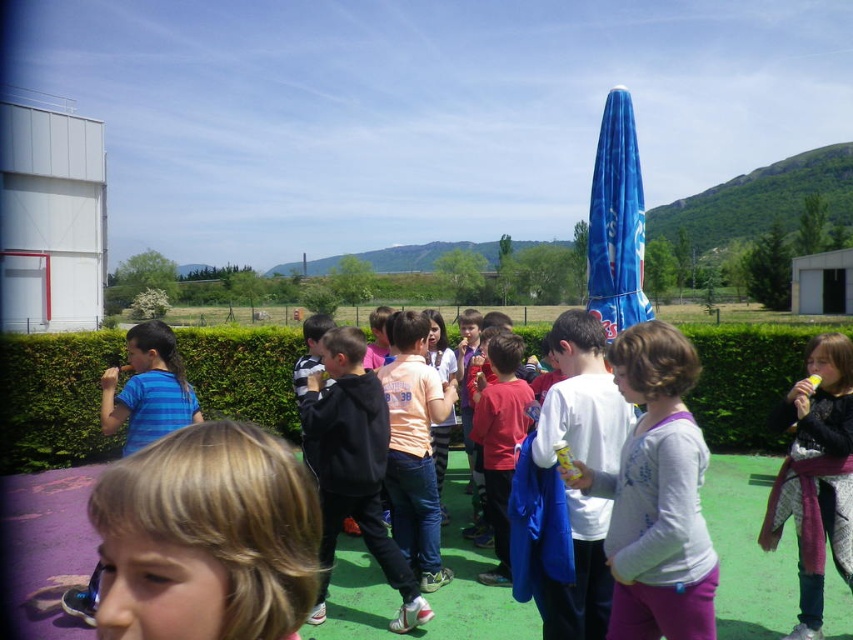
Does black matte jacket at center appear over black knit sweater at right?

Actually, black matte jacket at center is below black knit sweater at right.

Between black matte jacket at center and black knit sweater at right, which one has less height?

black knit sweater at right

Where is `black matte jacket at center`? This screenshot has width=853, height=640. black matte jacket at center is located at coordinates tap(352, 467).

Which of these two, white cotton shirt at center or red matte shirt at center, stands taller?

red matte shirt at center

Does white cotton shirt at center appear on the right side of red matte shirt at center?

Correct, you'll find white cotton shirt at center to the right of red matte shirt at center.

Who is more distant from viewer, (645, 424) or (509, 432)?

Positioned behind is point (509, 432).

The image size is (853, 640). I want to click on white cotton shirt at center, so click(656, 493).

Who is positioned more to the right, white cotton shirt at center or white matte shirt at center?

white cotton shirt at center

Is white cotton shirt at center smaller than white matte shirt at center?

Correct, white cotton shirt at center occupies less space than white matte shirt at center.

Find the location of `white cotton shirt at center`. white cotton shirt at center is located at coordinates (656, 493).